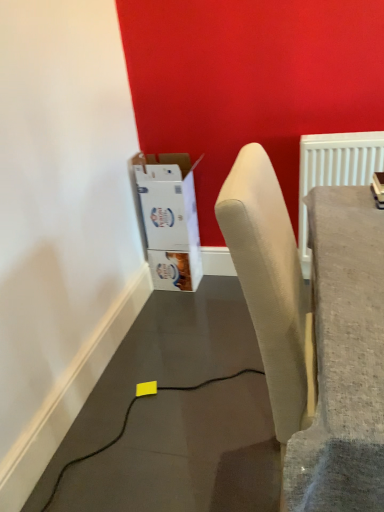
Image resolution: width=384 pixels, height=512 pixels. Identify the location of white cardboard box at lower left. (168, 219).

What do you see at coordinates (168, 219) in the screenshot? I see `white cardboard box at lower left` at bounding box center [168, 219].

This screenshot has height=512, width=384. Identify the location of white cardboard box at lower left. (168, 219).